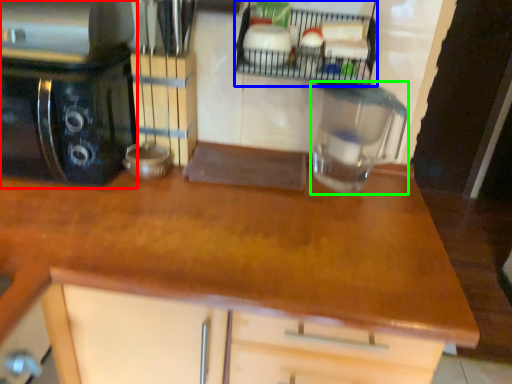
Question: Which object is positioned farthest from home appliance (highlighted by a red box)? Select from shelf (highlighted by a blue box) and kitchen appliance (highlighted by a green box).

Choices:
 (A) shelf
 (B) kitchen appliance

Answer: (B)